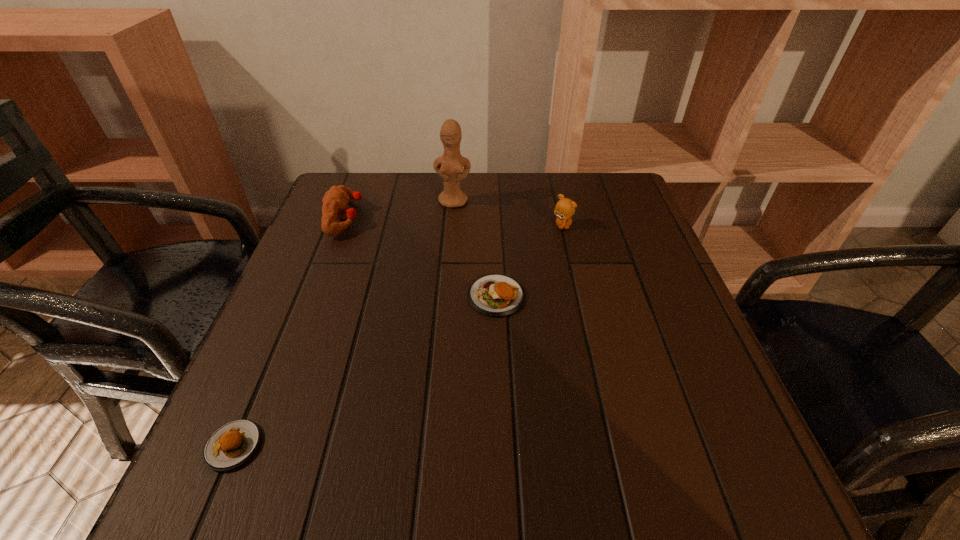
Where is `blank space located 0.120m on the right of the fourth farthest object`? The width and height of the screenshot is (960, 540). blank space located 0.120m on the right of the fourth farthest object is located at coordinates (585, 296).

Where is `free spot located on the right of the shorter food`? Image resolution: width=960 pixels, height=540 pixels. free spot located on the right of the shorter food is located at coordinates (498, 446).

Where is `figurine located in the far edge section of the desktop`? This screenshot has width=960, height=540. figurine located in the far edge section of the desktop is located at coordinates (449, 167).

You are a GUI agent. You are given a task and a screenshot of the screen. Output one action in this format:
    pyautogui.click(x=<x>, y=<y>)
    Task: Click on the teddy bear at the far edge
    
    Given the screenshot: What is the action you would take?
    pyautogui.click(x=565, y=208)

You are a GUI agent. You are given a task and a screenshot of the screen. Output one action in this format:
    pyautogui.click(x=<x>, y=<y>)
    Task: Click on the puncher that is positioned at the far edge
    The height and width of the screenshot is (540, 960).
    Given the screenshot: What is the action you would take?
    pyautogui.click(x=335, y=201)

Find the location of a particular element. object at the near edge is located at coordinates (232, 444).

Where is `puncher present at the left edge`? The image size is (960, 540). puncher present at the left edge is located at coordinates (335, 201).

You are a GUI agent. You are given a task and a screenshot of the screen. Output one action in this format:
    pyautogui.click(x=<x>, y=<y>)
    Task: Click on the food that is positioned at the left edge
    This screenshot has height=540, width=960.
    Given the screenshot: What is the action you would take?
    pyautogui.click(x=232, y=444)

At what (x,y) coordinates should I click in order to perform the action: click on object that is positioned at the far left corner. Please return your answer as a coordinate pair (x, y). This screenshot has height=540, width=960. Looking at the image, I should click on (335, 201).

This screenshot has width=960, height=540. I want to click on object located in the near left corner section of the desktop, so click(232, 444).